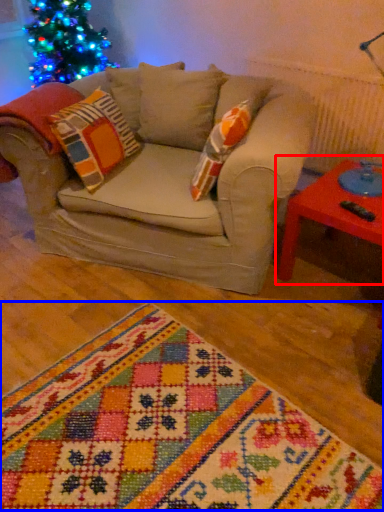
Question: Which point is further to the camera, table (highlighted by a red box) or blanket (highlighted by a blue box)?

Choices:
 (A) table
 (B) blanket

Answer: (A)